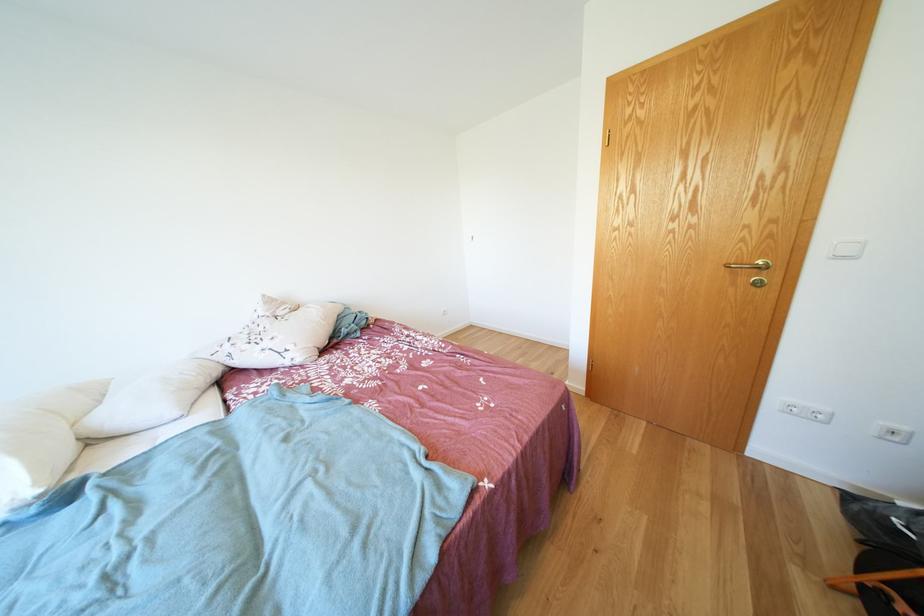
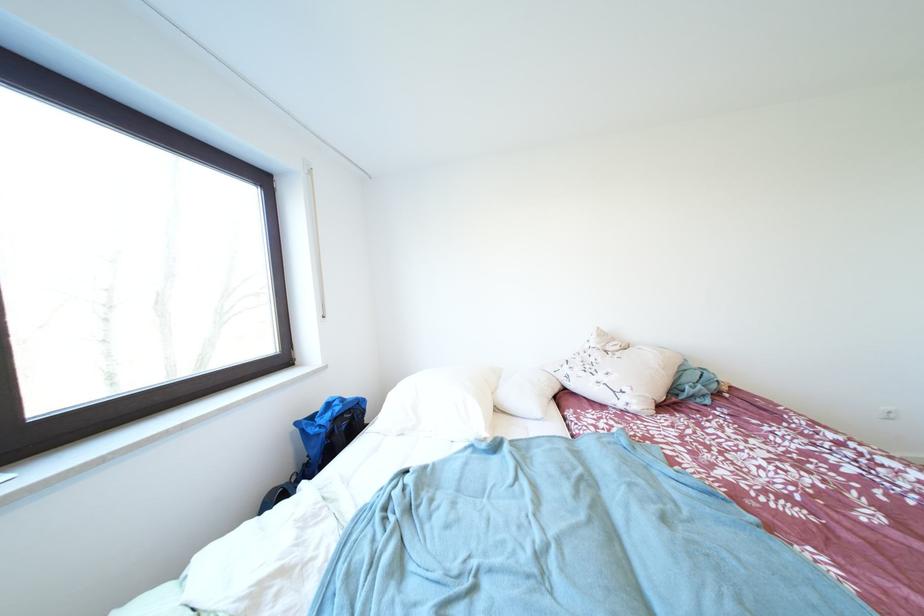
Question: The camera is either moving clockwise (left) or counter-clockwise (right) around the object. The first image is from the beginning of the video and the second image is from the end. Is the camera moving left or right when shooting the video?

Choices:
 (A) Left
 (B) Right

Answer: (B)